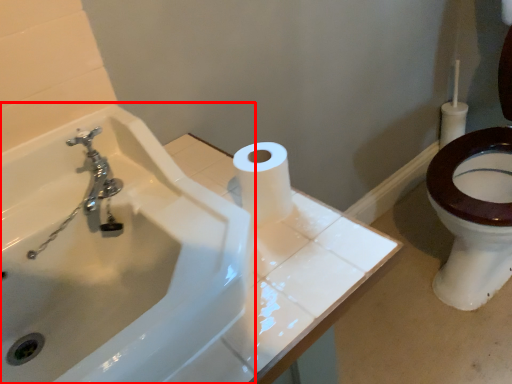
Question: From the image's perspective, considering the relative positions of sink (annotated by the red box) and toilet paper in the image provided, where is sink (annotated by the red box) located with respect to the staircase?

Choices:
 (A) above
 (B) below

Answer: (B)